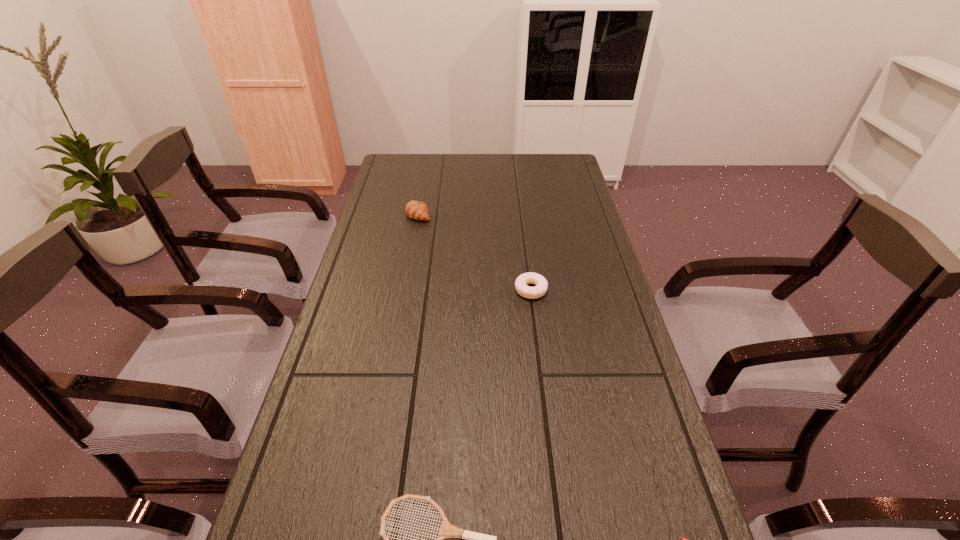
In the image, there is a desktop. In order to click on free space at the far left corner in this screenshot , I will do `click(401, 165)`.

In the image, there is a desktop. Identify the location of vacant space at the far right corner. This screenshot has height=540, width=960. (540, 153).

Identify the location of vacant area between the farthest object and the third object from left to right. The height and width of the screenshot is (540, 960). (475, 252).

Find the location of a particular element. Image resolution: width=960 pixels, height=540 pixels. free space between the second object from right to left and the tallest object is located at coordinates [475, 252].

Select which object is the closest to the tallest object. Please provide its 2D coordinates. Your answer should be formatted as a tuple, i.e. [(x, y)], where the tuple contains the x and y coordinates of a point satisfying the conditions above.

[(541, 284)]

Identify which object is the third closest to the doughnut. Please provide its 2D coordinates. Your answer should be formatted as a tuple, i.e. [(x, y)], where the tuple contains the x and y coordinates of a point satisfying the conditions above.

[(683, 539)]

Locate an element on the screen. The height and width of the screenshot is (540, 960). vacant position in the image that satisfies the following two spatial constraints: 1. on the front side of the second tallest object; 2. on the left side of the farthest object is located at coordinates (404, 290).